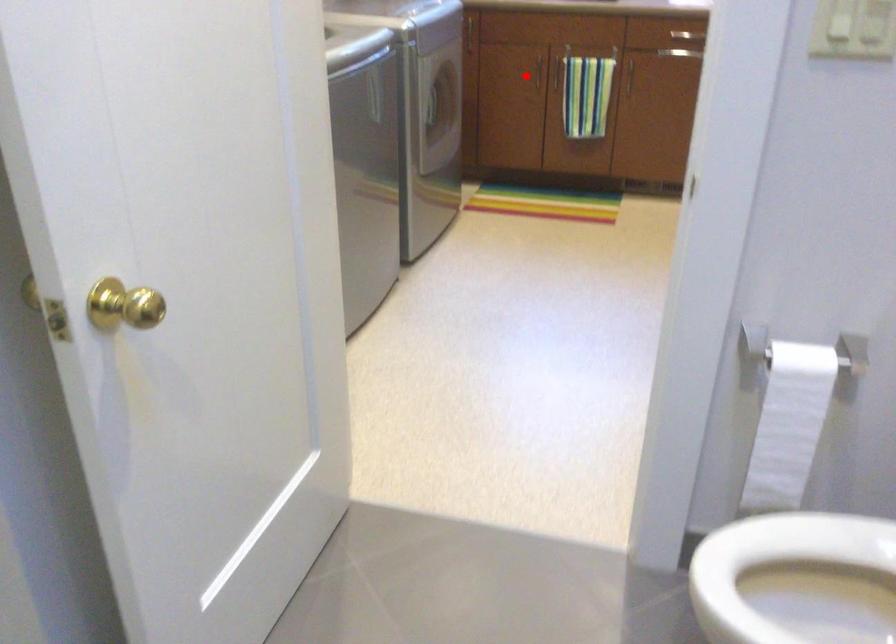
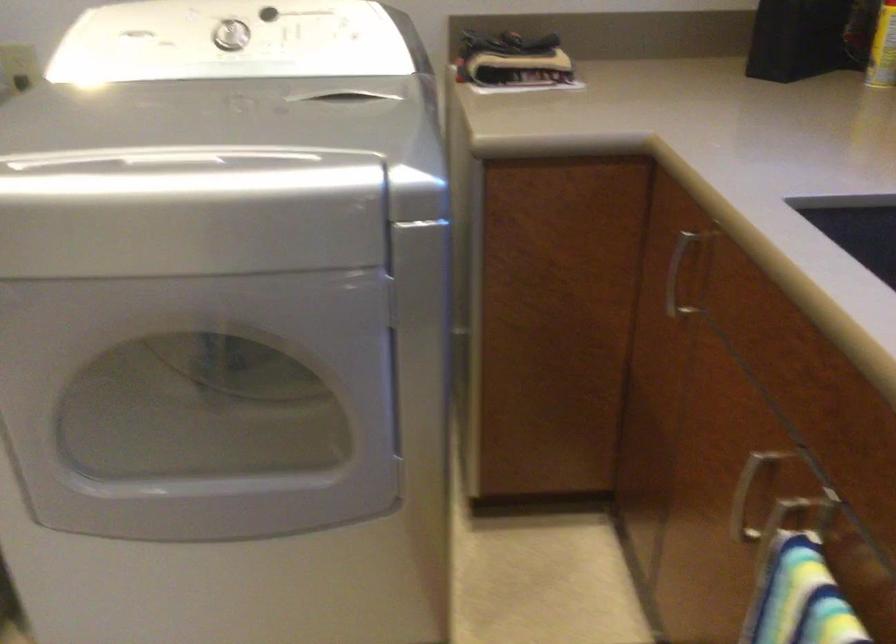
Question: I am providing you with two images of the same scene from different viewpoints. A red point is shown in image1. For the corresponding object point in image2, is it positioned nearer or farther from the camera?

Choices:
 (A) Nearer
 (B) Farther

Answer: (A)